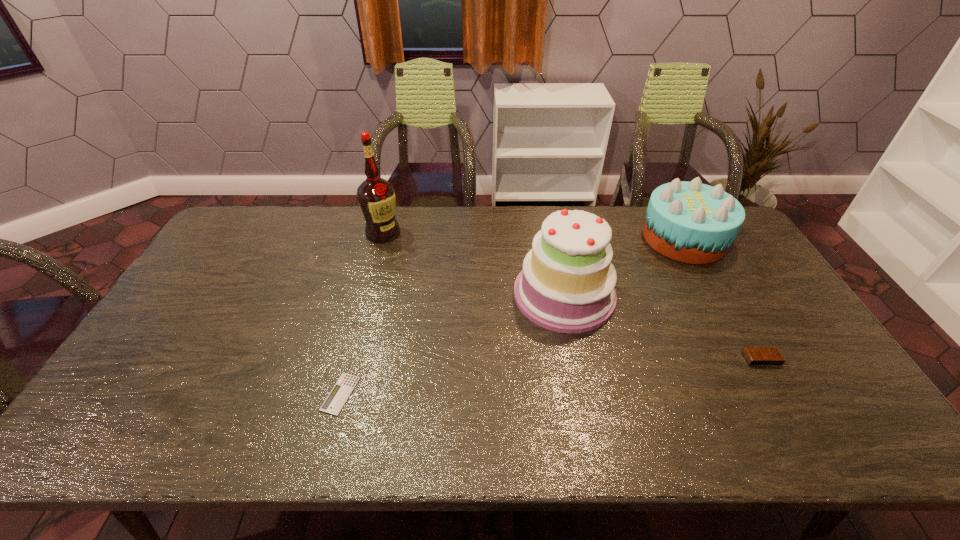
Image resolution: width=960 pixels, height=540 pixels. In order to click on the tallest object in this screenshot , I will do `click(376, 196)`.

Where is `the taller cake`? Image resolution: width=960 pixels, height=540 pixels. the taller cake is located at coordinates (567, 283).

Image resolution: width=960 pixels, height=540 pixels. What are the coordinates of `the left cake` in the screenshot? It's located at (567, 283).

What are the coordinates of `the third tallest object` in the screenshot? It's located at (690, 222).

At what (x,y) coordinates should I click in order to perform the action: click on the shorter cake. Please return your answer as a coordinate pair (x, y). The width and height of the screenshot is (960, 540). Looking at the image, I should click on (690, 222).

Find the location of a particular element. the fourth tallest object is located at coordinates (755, 356).

Identify the location of the second nearest object. (755, 356).

Identify the location of the nearest object. (336, 399).

Find the location of a particular element. calculator is located at coordinates (336, 399).

Locate an element on the screen. The height and width of the screenshot is (540, 960). vacant space located on the label of the tallest object is located at coordinates (372, 273).